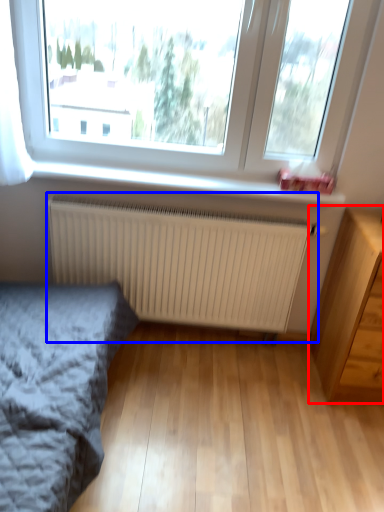
Question: Which of the following is the closest to the observer, chest of drawers (highlighted by a red box) or radiator (highlighted by a blue box)?

Choices:
 (A) chest of drawers
 (B) radiator

Answer: (A)